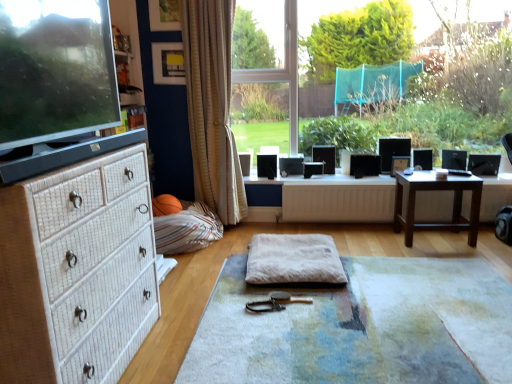
Find the location of a particular element. The height and width of the screenshot is (384, 512). blank space to the left of brown wooden table at right is located at coordinates [x=377, y=240].